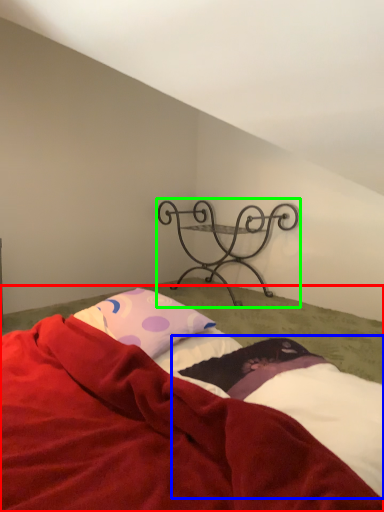
Question: Estimate the real-world distances between objects in this image. Which object is farther from bed (highlighted by a red box), sheet (highlighted by a blue box) or furniture (highlighted by a green box)?

Choices:
 (A) sheet
 (B) furniture

Answer: (B)